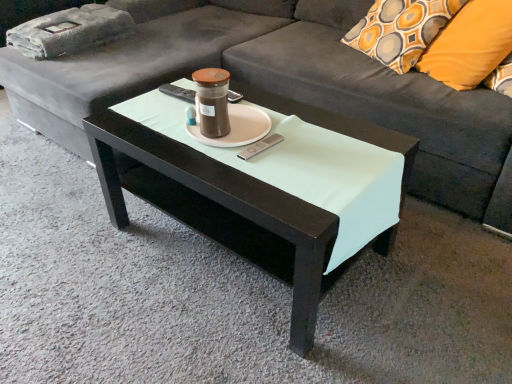
You are a GUI agent. You are given a task and a screenshot of the screen. Output one action in this format:
    pyautogui.click(x=<x>, y=<y>)
    Task: Click on the matte black coffee table at center
    This screenshot has width=512, height=384.
    Given the screenshot: What is the action you would take?
    pyautogui.click(x=263, y=187)

This screenshot has height=384, width=512. What are the coordinates of `matte brown glass candle holder at center` in the screenshot? It's located at (212, 101).

Is point (226, 109) more distant than point (285, 123)?

No, (226, 109) is in front of (285, 123).

Is matte brown glass candle holder at center with matte black coffee table at center?

No, matte brown glass candle holder at center is not next to matte black coffee table at center.

In the scene shown: Is matte brown glass candle holder at center to the right of matte black coffee table at center from the viewer's perspective?

Incorrect, matte brown glass candle holder at center is not on the right side of matte black coffee table at center.

Can you confirm if dark gray fabric couch at center is positioned to the left of matte black coffee table at center?

In fact, dark gray fabric couch at center is to the right of matte black coffee table at center.

Who is smaller, dark gray fabric couch at center or matte black coffee table at center?

matte black coffee table at center is smaller.

Would you say dark gray fabric couch at center is a long distance from matte black coffee table at center?

Actually, dark gray fabric couch at center and matte black coffee table at center are a little close together.

Which point is more distant from viewer, (302, 4) or (233, 163)?

Point (302, 4)

Considering the positions of points (470, 213) and (219, 98), is point (470, 213) farther from camera compared to point (219, 98)?

That is True.

Can you tell me how much dark gray fabric couch at center and matte brown glass candle holder at center differ in facing direction?

dark gray fabric couch at center and matte brown glass candle holder at center are facing 2.36 degrees away from each other.

Is dark gray fabric couch at center far away from matte brown glass candle holder at center?

No.

Which is correct: dark gray fabric couch at center is inside matte brown glass candle holder at center, or outside of it?

dark gray fabric couch at center is located beyond the bounds of matte brown glass candle holder at center.

How many degrees apart are the facing directions of dark gray fabric couch at center and orange fabric pillow at upper right?

The angle between the facing direction of dark gray fabric couch at center and the facing direction of orange fabric pillow at upper right is 24.3 degrees.

Based on the photo, is dark gray fabric couch at center with orange fabric pillow at upper right?

No, dark gray fabric couch at center is not beside orange fabric pillow at upper right.

Is point (343, 104) closer to camera compared to point (493, 26)?

No, it is behind (493, 26).

From the image's perspective, is dark gray fabric couch at center located above or below orange fabric pillow at upper right?

From the image's perspective, dark gray fabric couch at center appears above orange fabric pillow at upper right.

Consider the image. Can you confirm if orange fabric pillow at upper right is positioned to the right of matte brown glass candle holder at center?

Indeed, orange fabric pillow at upper right is positioned on the right side of matte brown glass candle holder at center.

Considering the positions of points (452, 68) and (196, 98), is point (452, 68) closer to camera compared to point (196, 98)?

No.

Which is correct: orange fabric pillow at upper right is inside matte brown glass candle holder at center, or outside of it?

orange fabric pillow at upper right is outside matte brown glass candle holder at center.

From the image's perspective, is orange fabric pillow at upper right under matte brown glass candle holder at center?

No.

Is matte black coffee table at center completely or partially outside of matte brown glass candle holder at center?

matte black coffee table at center lies outside matte brown glass candle holder at center's area.

From the picture: What's the angular difference between matte black coffee table at center and matte brown glass candle holder at center's facing directions?

The angle between the facing direction of matte black coffee table at center and the facing direction of matte brown glass candle holder at center is 0.868 degrees.

From the picture: Would you consider matte black coffee table at center to be distant from matte brown glass candle holder at center?

They are positioned close to each other.

Is matte black coffee table at center looking in the opposite direction of matte brown glass candle holder at center?

No, matte black coffee table at center is not facing away from matte brown glass candle holder at center.

Is point (442, 57) closer or farther from the camera than point (283, 72)?

Point (442, 57) is closer to the camera than point (283, 72).

From a real-world perspective, is orange fabric pillow at upper right positioned over dark gray fabric couch at center based on gravity?

Yes, from a real-world perspective, orange fabric pillow at upper right is above dark gray fabric couch at center.

Which object is closer to the camera taking this photo, orange fabric pillow at upper right or dark gray fabric couch at center?

Positioned in front is dark gray fabric couch at center.

In the scene shown: How much distance is there between orange fabric pillow at upper right and dark gray fabric couch at center?

orange fabric pillow at upper right is 20.56 inches from dark gray fabric couch at center.

Locate an element on the screen. The image size is (512, 384). candle holder lying behind the matte black coffee table at center is located at coordinates (212, 101).

At what (x,y) coordinates should I click in order to perform the action: click on studio couch that is above the matte black coffee table at center (from the image's perspective). Please return your answer as a coordinate pair (x, y). The width and height of the screenshot is (512, 384). Looking at the image, I should click on (282, 87).

From the image, which object appears to be farther from matte black coffee table at center, orange fabric pillow at upper right or dark gray fabric couch at center?

orange fabric pillow at upper right is positioned further to the anchor matte black coffee table at center.

Which object lies further to the anchor point orange fabric pillow at upper right, matte brown glass candle holder at center or dark gray fabric couch at center?

The object further to orange fabric pillow at upper right is matte brown glass candle holder at center.

Considering their positions, is orange fabric pillow at upper right positioned further to matte brown glass candle holder at center than matte black coffee table at center?

orange fabric pillow at upper right.

From the image, which object appears to be farther from dark gray fabric couch at center, matte brown glass candle holder at center or matte black coffee table at center?

Based on the image, matte brown glass candle holder at center appears to be further to dark gray fabric couch at center.

From the image, which object appears to be nearer to matte brown glass candle holder at center, orange fabric pillow at upper right or dark gray fabric couch at center?

dark gray fabric couch at center lies closer to matte brown glass candle holder at center than the other object.

Which object lies further to the anchor point orange fabric pillow at upper right, dark gray fabric couch at center or matte black coffee table at center?

matte black coffee table at center lies further to orange fabric pillow at upper right than the other object.

Which object lies further to the anchor point matte black coffee table at center, dark gray fabric couch at center or matte brown glass candle holder at center?

The object further to matte black coffee table at center is dark gray fabric couch at center.

When comparing their distances from matte brown glass candle holder at center, does dark gray fabric couch at center or matte black coffee table at center seem further?

dark gray fabric couch at center is positioned further to the anchor matte brown glass candle holder at center.

You are a GUI agent. You are given a task and a screenshot of the screen. Output one action in this format:
    pyautogui.click(x=<x>, y=<y>)
    Task: Click on the studio couch located between matte brown glass candle holder at center and orange fabric pillow at upper right in the left-right direction
    The height and width of the screenshot is (384, 512).
    Given the screenshot: What is the action you would take?
    pyautogui.click(x=282, y=87)

At what (x,y) coordinates should I click in order to perform the action: click on studio couch located between matte black coffee table at center and orange fabric pillow at upper right in the left-right direction. Please return your answer as a coordinate pair (x, y). Looking at the image, I should click on (282, 87).

You are a GUI agent. You are given a task and a screenshot of the screen. Output one action in this format:
    pyautogui.click(x=<x>, y=<y>)
    Task: Click on the coffee table between dark gray fabric couch at center and matte brown glass candle holder at center in the front-back direction
    The height and width of the screenshot is (384, 512).
    Given the screenshot: What is the action you would take?
    pyautogui.click(x=263, y=187)

Where is `coffee table situated between matte brown glass candle holder at center and orange fabric pillow at upper right from left to right`? coffee table situated between matte brown glass candle holder at center and orange fabric pillow at upper right from left to right is located at coordinates (263, 187).